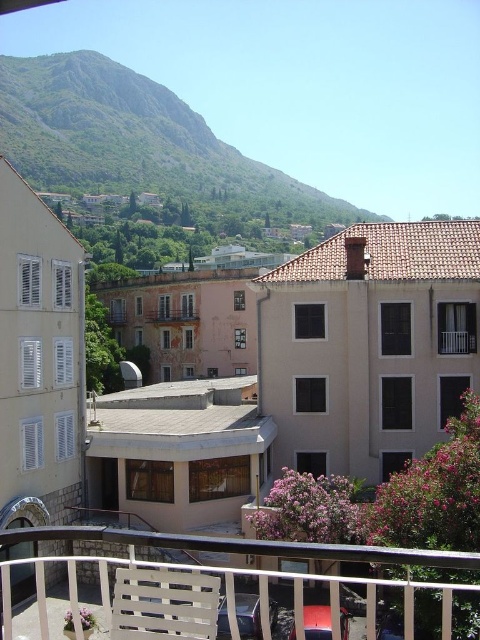
Question: Among these objects, which one is farthest from the camera?

Choices:
 (A) brown wooden balcony at center
 (B) white plastic chair at lower center
 (C) white wooden balcony at lower right

Answer: (A)

Question: Which of the following is the closest to the observer?

Choices:
 (A) white wooden balcony at lower right
 (B) white plastic chair at lower center
 (C) brown wooden balcony at center

Answer: (B)

Question: Which object is positioned farthest from the brown wooden balcony at center?

Choices:
 (A) white plastic chair at lower center
 (B) white wooden balcony at lower right

Answer: (A)

Question: Is white plastic chair at lower center to the left of white wooden balcony at lower right from the viewer's perspective?

Choices:
 (A) no
 (B) yes

Answer: (B)

Question: Can you confirm if white plastic chair at lower center is positioned to the left of white wooden balcony at lower right?

Choices:
 (A) no
 (B) yes

Answer: (B)

Question: Can you confirm if white plastic chair at lower center is thinner than brown wooden balcony at center?

Choices:
 (A) yes
 (B) no

Answer: (B)